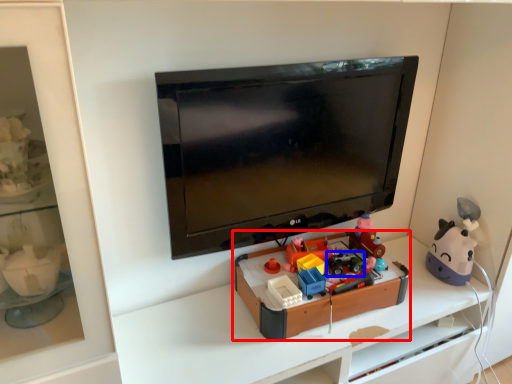
Question: Which object appears closest to the camera in this image, toy (highlighted by a red box) or toy (highlighted by a blue box)?

Choices:
 (A) toy
 (B) toy

Answer: (A)